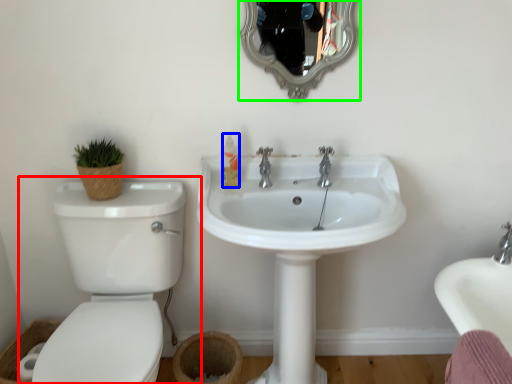
Question: Which is farther away from toilet (highlighted by a red box)? toiletry (highlighted by a blue box) or mirror (highlighted by a green box)?

Choices:
 (A) toiletry
 (B) mirror

Answer: (B)